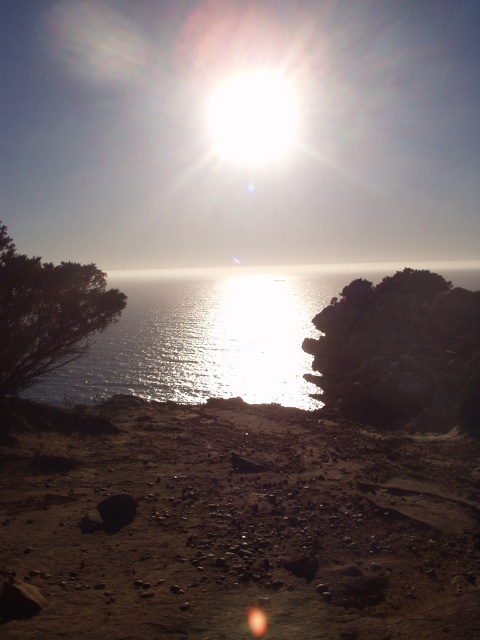
Is dull brown sand at lower center closer to camera compared to dark rock at right?

Yes, it is in front of dark rock at right.

Which is below, dull brown sand at lower center or dark rock at right?

Positioned lower is dull brown sand at lower center.

The width and height of the screenshot is (480, 640). Describe the element at coordinates (238, 524) in the screenshot. I see `dull brown sand at lower center` at that location.

Where is `dull brown sand at lower center`? This screenshot has width=480, height=640. dull brown sand at lower center is located at coordinates (238, 524).

Is point (316, 273) closer to camera compared to point (456, 324)?

No.

Is silvery reflective water at center to the right of dark rock at right from the viewer's perspective?

Yes, silvery reflective water at center is to the right of dark rock at right.

Is point (115, 372) less distant than point (372, 285)?

That is False.

You are a GUI agent. You are given a task and a screenshot of the screen. Output one action in this format:
    pyautogui.click(x=<x>, y=<y>)
    Task: Click on the silvery reflective water at center
    This screenshot has height=640, width=480.
    Given the screenshot: What is the action you would take?
    pyautogui.click(x=208, y=336)

Does dull brown sand at lower center have a larger size compared to silvery reflective water at center?

Actually, dull brown sand at lower center might be smaller than silvery reflective water at center.

Can you confirm if dull brown sand at lower center is positioned above silvery reflective water at center?

No.

Between point (35, 524) and point (235, 369), which one is positioned behind?

The point (235, 369) is more distant.

Image resolution: width=480 pixels, height=640 pixels. In order to click on dull brown sand at lower center in this screenshot , I will do `click(238, 524)`.